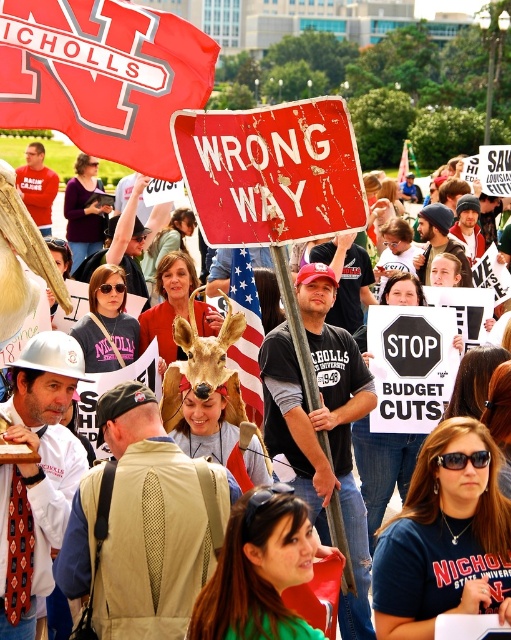
Question: Which point is farther to the camera?

Choices:
 (A) (282, 232)
 (B) (235, 308)

Answer: (B)

Question: Is rusty metal sign at center bigger than american flag at center?

Choices:
 (A) yes
 (B) no

Answer: (B)

Question: Which point is closer to the camera?

Choices:
 (A) american flag at center
 (B) rusty metal sign at center

Answer: (B)

Question: Considering the relative positions of rusty metal sign at center and american flag at center in the image provided, where is rusty metal sign at center located with respect to american flag at center?

Choices:
 (A) above
 (B) below

Answer: (A)

Question: Can you confirm if rusty metal sign at center is positioned to the left of american flag at center?

Choices:
 (A) yes
 (B) no

Answer: (B)

Question: Which of the following is the closest to the observer?

Choices:
 (A) rusty metal sign at center
 (B) american flag at center

Answer: (A)